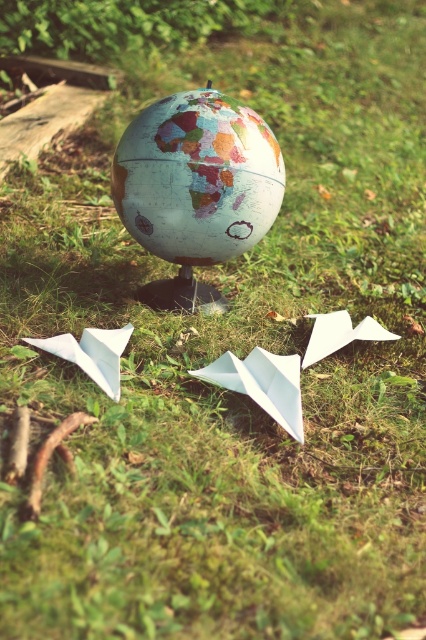
Is point (152, 216) farther from camera compared to point (75, 356)?

Yes, it is behind point (75, 356).

Between matte globe at center and white paper at lower left, which one is positioned lower?

Positioned lower is white paper at lower left.

In order to click on matte globe at center in this screenshot , I will do `click(198, 177)`.

Can you confirm if white paper airplane at center is shorter than white paper at lower left?

Incorrect, white paper airplane at center's height does not fall short of white paper at lower left's.

Measure the distance between point [227,385] and camera.

2.08 meters

Find the location of `white paper airplane at center`. white paper airplane at center is located at coordinates (261, 384).

Which is above, matte globe at center or white paper airplane at center?

Positioned higher is matte globe at center.

Can you confirm if matte globe at center is thinner than white paper airplane at center?

Incorrect, matte globe at center's width is not less than white paper airplane at center's.

You are a GUI agent. You are given a task and a screenshot of the screen. Output one action in this format:
    pyautogui.click(x=<x>, y=<y>)
    Task: Click on the matte globe at center
    This screenshot has height=640, width=426.
    Given the screenshot: What is the action you would take?
    tap(198, 177)